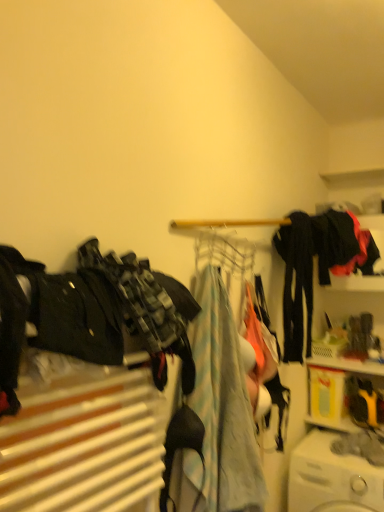
Question: Choose the correct answer: Is light blue fabric at center, which is the 2th clothing from front to back, inside white plastic washing machine at lower right or outside it?

Choices:
 (A) inside
 (B) outside

Answer: (B)

Question: In terms of height, does light blue fabric at center, which is the 2th clothing from front to back, look taller or shorter compared to white plastic washing machine at lower right?

Choices:
 (A) tall
 (B) short

Answer: (A)

Question: Estimate the real-world distances between objects in this image. Which object is farther from the white plastic washing machine at lower right?

Choices:
 (A) black matte pants at center right, the 3th clothing in the front-to-back sequence
 (B) camouflage fabric pants at left, the 1th clothing from the left
 (C) light blue fabric at center, which appears as the 3th clothing when viewed from the back
 (D) black matte jacket at upper right, which is the 4th clothing from left to right
 (E) metallic wire clothesline at center

Answer: (B)

Question: Which object is positioned farthest from the black matte pants at center right, the second clothing when ordered from right to left?

Choices:
 (A) camouflage fabric pants at left, which ranks as the fourth clothing in right-to-left order
 (B) black matte jacket at upper right, which is the 4th clothing from left to right
 (C) white plastic washing machine at lower right
 (D) metallic wire clothesline at center
 (E) light blue fabric at center, the 3th clothing positioned from the right

Answer: (A)